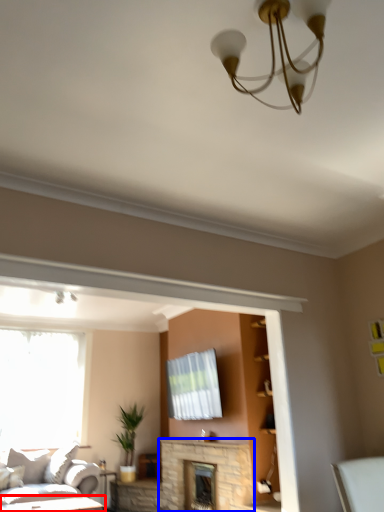
Question: Which object appears closest to the camera in this image, table (highlighted by a red box) or fireplace (highlighted by a blue box)?

Choices:
 (A) table
 (B) fireplace

Answer: (A)